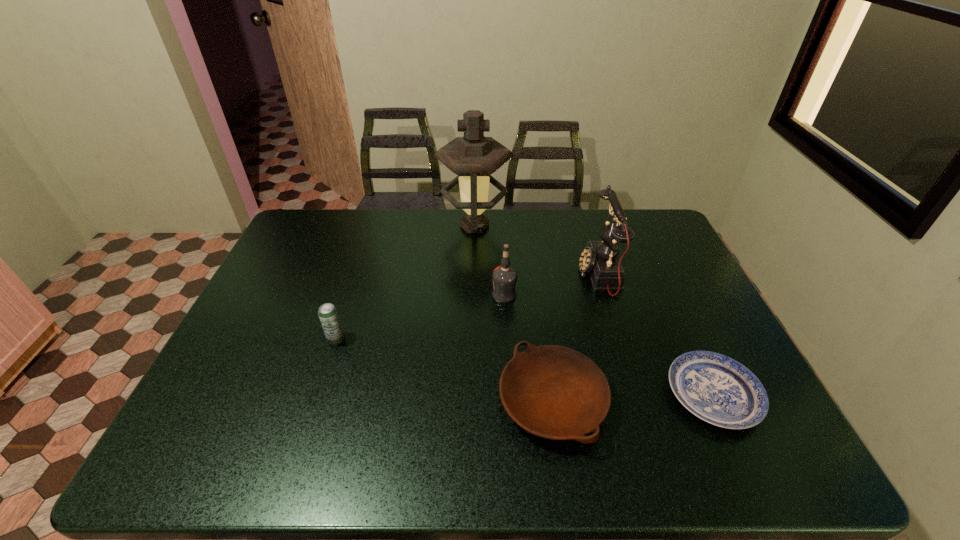
Where is `blank area located on the left of the right plate`? The image size is (960, 540). blank area located on the left of the right plate is located at coordinates (605, 395).

The width and height of the screenshot is (960, 540). What are the coordinates of `oil lamp located at the far edge` in the screenshot? It's located at (473, 157).

At what (x,y) coordinates should I click in order to perform the action: click on telephone at the far edge. Please return your answer as a coordinate pair (x, y). Looking at the image, I should click on (600, 259).

Identify the location of object that is positioned at the right edge. The width and height of the screenshot is (960, 540). (719, 390).

I want to click on object located at the near right corner, so click(719, 390).

Locate an element on the screen. Image resolution: width=960 pixels, height=540 pixels. vacant space at the far edge of the desktop is located at coordinates (358, 237).

Where is `blank area at the near edge`? Image resolution: width=960 pixels, height=540 pixels. blank area at the near edge is located at coordinates (560, 454).

You are a GUI agent. You are given a task and a screenshot of the screen. Output one action in this format:
    pyautogui.click(x=<x>, y=<y>)
    Task: Click on the free space at the left edge
    The width and height of the screenshot is (960, 540).
    Given the screenshot: What is the action you would take?
    pyautogui.click(x=285, y=330)

Image resolution: width=960 pixels, height=540 pixels. In the image, there is a desktop. What are the coordinates of `vacant space at the right edge` in the screenshot? It's located at (647, 270).

The image size is (960, 540). In the image, there is a desktop. Find the location of `vacant region at the far left corner`. vacant region at the far left corner is located at coordinates (327, 240).